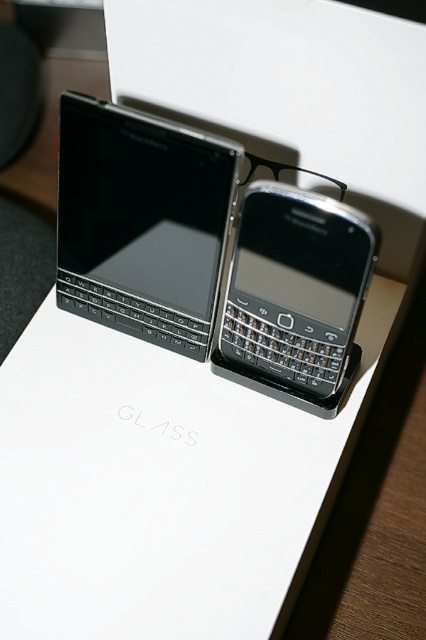
You are setting up a desk for a client who prefers ergonomic devices. You have a matte black keyboard at upper left and a black matte smartphone at center. Which device should you place closer to the user if the keyboard requires more space?

The matte black keyboard at upper left requires more space due to its larger size compared to the black matte smartphone at center, so it should be placed closer to the user to ensure adequate space for comfortable use.

Based on the photo, you are designing a layout for a product catalog and need to place an icon exactly at the coordinates where the matte black keyboard at upper left is located. What are the coordinates you should use?

The coordinates for the matte black keyboard at upper left are at point (141, 221).

You are taking a photo of the two BlackBerry devices on the display stand. Which of the two points, point (120, 122) or point (328, 380), will appear larger in the photo?

Point (120, 122) will appear larger in the photo because it is closer to the camera than point (328, 380).